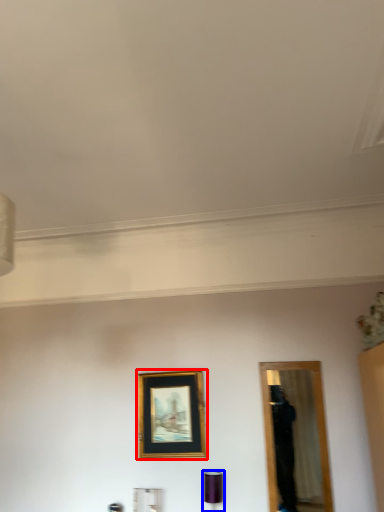
Question: Which object is further to the camera taking this photo, picture frame (highlighted by a red box) or lamp (highlighted by a blue box)?

Choices:
 (A) picture frame
 (B) lamp

Answer: (A)